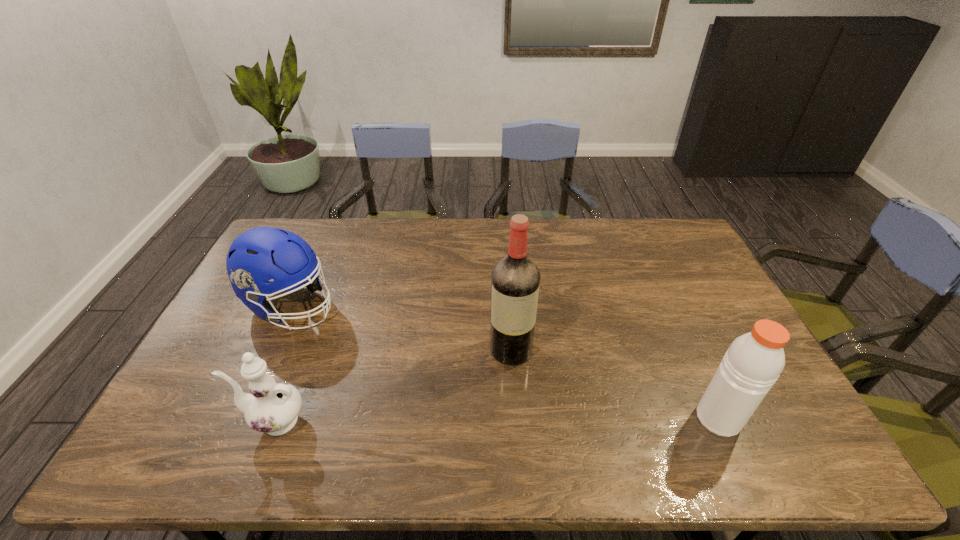
This screenshot has height=540, width=960. In order to click on vacant region located on the front-facing side of the tallest object in this screenshot , I will do `click(515, 395)`.

The image size is (960, 540). Identify the location of vacant area situated on the front-facing side of the tallest object. (514, 382).

At what (x,y) coordinates should I click in order to perform the action: click on free point located on the front-facing side of the football helmet. Please return your answer as a coordinate pair (x, y). The width and height of the screenshot is (960, 540). Looking at the image, I should click on (368, 339).

Where is `vacant position located 0.210m on the front-facing side of the football helmet`? The width and height of the screenshot is (960, 540). vacant position located 0.210m on the front-facing side of the football helmet is located at coordinates (381, 346).

Find the location of `free spot located on the front-facing side of the football helmet`. free spot located on the front-facing side of the football helmet is located at coordinates [x=349, y=330].

Locate an element on the screen. The width and height of the screenshot is (960, 540). chinaware situated at the near edge is located at coordinates (272, 407).

You are a GUI agent. You are given a task and a screenshot of the screen. Output one action in this format:
    pyautogui.click(x=<x>, y=<y>)
    Task: Click on the shaker at the near edge
    The height and width of the screenshot is (540, 960).
    Given the screenshot: What is the action you would take?
    pyautogui.click(x=753, y=362)

The width and height of the screenshot is (960, 540). I want to click on object that is at the left edge, so click(x=260, y=254).

Find the location of `object present at the right edge`. object present at the right edge is located at coordinates (753, 362).

Locate an element on the screen. object situated at the near right corner is located at coordinates (753, 362).